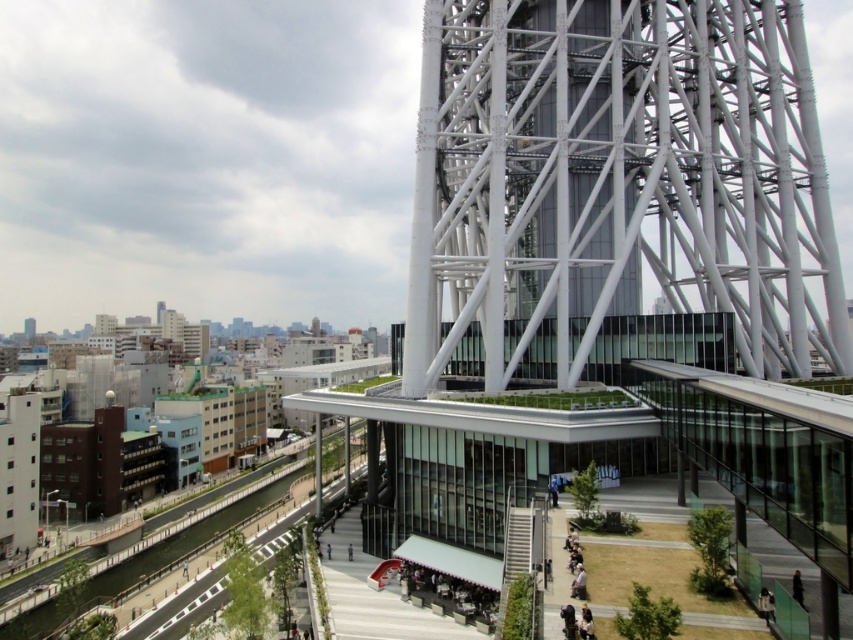
Question: Is white metallic tower at center closer to camera compared to dark gray fabric jacket at lower center?

Choices:
 (A) no
 (B) yes

Answer: (B)

Question: Can you confirm if white metallic tower at center is positioned below dark gray fabric jacket at lower center?

Choices:
 (A) yes
 (B) no

Answer: (B)

Question: Among these points, which one is nearest to the camera?

Choices:
 (A) (654, 182)
 (B) (802, 602)
 (C) (764, 602)

Answer: (B)

Question: Which point is closer to the camera?

Choices:
 (A) (798, 579)
 (B) (758, 598)

Answer: (A)

Question: Which object is the farthest from the white metallic tower at center?

Choices:
 (A) dark gray fabric jacket at lower center
 (B) black fabric person at lower right

Answer: (B)

Question: Does white metallic tower at center have a smaller size compared to black fabric person at lower right?

Choices:
 (A) no
 (B) yes

Answer: (A)